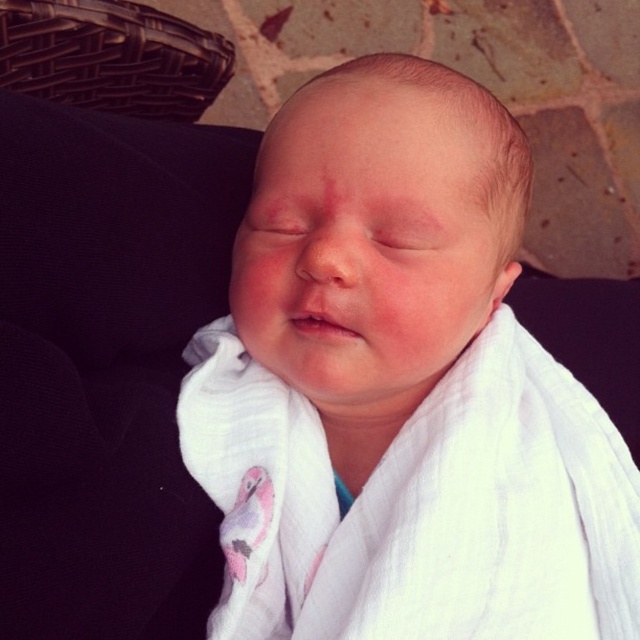
Question: Among these objects, which one is nearest to the camera?

Choices:
 (A) brown woven basket at upper left
 (B) white muslin cloth at center

Answer: (B)

Question: Which object appears closest to the camera in this image?

Choices:
 (A) brown woven basket at upper left
 (B) white muslin cloth at center

Answer: (B)

Question: Is white muslin cloth at center smaller than brown woven basket at upper left?

Choices:
 (A) yes
 (B) no

Answer: (B)

Question: Can you confirm if white muslin cloth at center is positioned above brown woven basket at upper left?

Choices:
 (A) no
 (B) yes

Answer: (A)

Question: Is white muslin cloth at center behind brown woven basket at upper left?

Choices:
 (A) yes
 (B) no

Answer: (B)